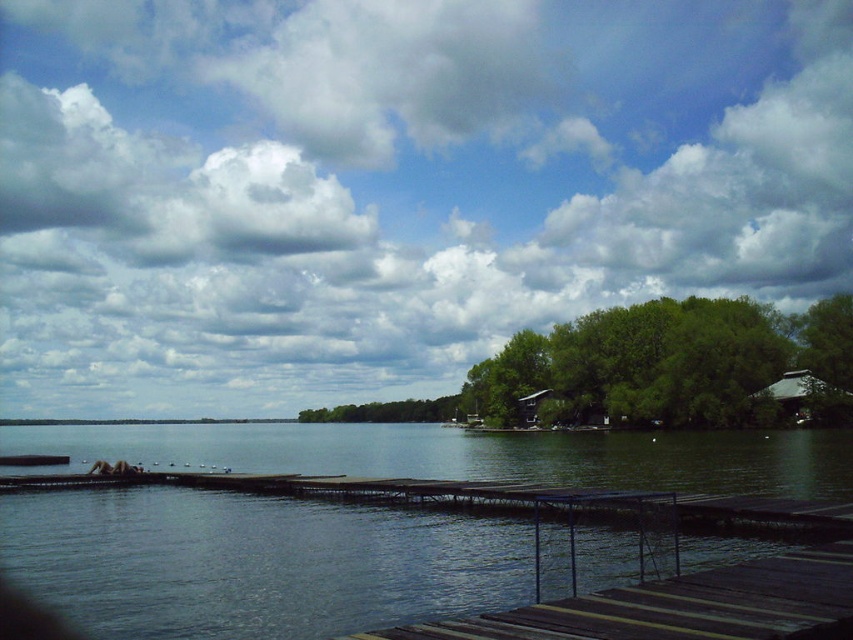
Question: Does white fluffy cloud at upper center appear under green leafy trees at center?

Choices:
 (A) no
 (B) yes

Answer: (A)

Question: Among these objects, which one is farthest from the camera?

Choices:
 (A) white fluffy cloud at upper center
 (B) wooden planks at center
 (C) green leafy trees at center

Answer: (A)

Question: Can you confirm if white fluffy cloud at upper center is bigger than green leafy trees at center?

Choices:
 (A) yes
 (B) no

Answer: (A)

Question: Which is farther from the wooden planks at center?

Choices:
 (A) white fluffy cloud at upper center
 (B) transparent water at center
 (C) green leafy trees at center

Answer: (A)

Question: Is green leafy trees at center behind wooden planks at center?

Choices:
 (A) no
 (B) yes

Answer: (B)

Question: Based on their relative distances, which object is farther from the transparent water at center?

Choices:
 (A) green leafy trees at center
 (B) white fluffy cloud at upper center
 (C) wooden planks at center

Answer: (B)